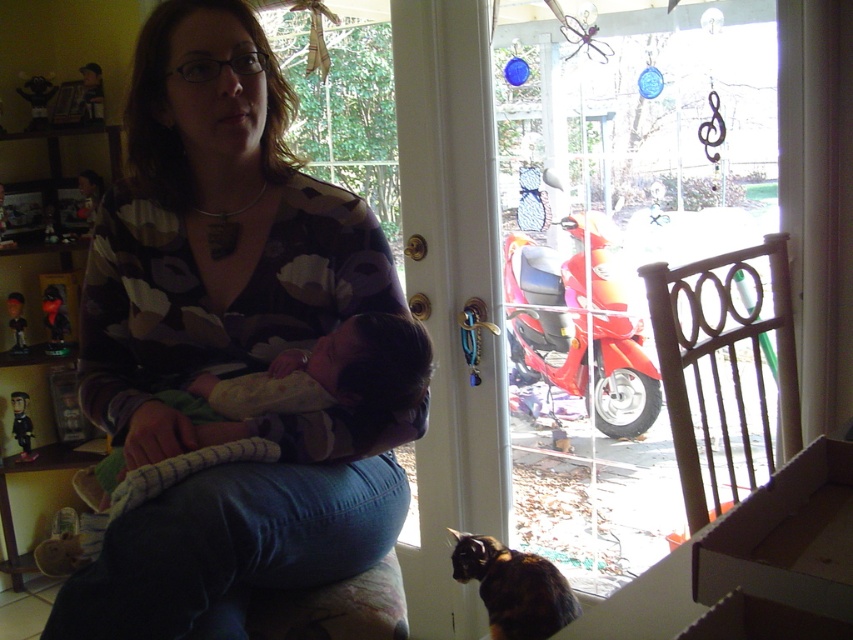
Based on the photo, you are a delivery person who just arrived at the house. You need to place a small package on the ground near the calico fur cat at lower center so that it stays visible to the homeowner. Given the white cardboard box at lower right is already there, where should you place the package?

Place the package next to the white cardboard box at lower right since it is shorter than the calico fur cat at lower center, ensuring the package remains visible.

You are a photographer setting up a shot of the scene. You need to ensure that the matte floral shirt at center and the calico fur cat at lower center are both in focus. Which object should you adjust your camera focus to prioritize first if you want to capture both clearly?

The matte floral shirt at center is taller than calico fur cat at lower center, so you should prioritize focusing on the matte floral shirt at center first to ensure depth of field captures both subjects.